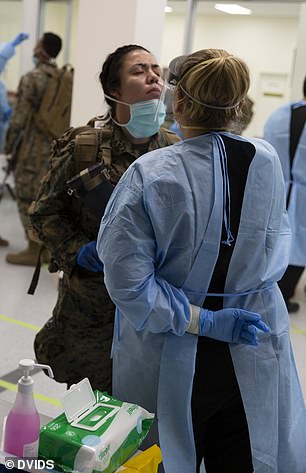
I want to click on hand sanitizer, so click(16, 433).